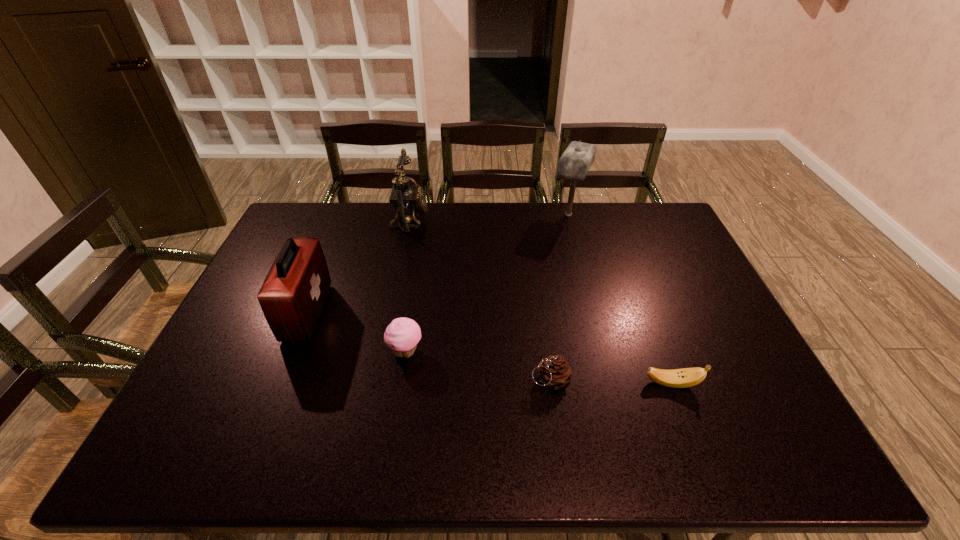
Where is `the second object from right to left`? the second object from right to left is located at coordinates (574, 164).

Where is `the tallest object`? The width and height of the screenshot is (960, 540). the tallest object is located at coordinates (574, 164).

This screenshot has width=960, height=540. What are the coordinates of `telephone` in the screenshot? It's located at tap(405, 198).

This screenshot has width=960, height=540. Identify the location of the leftmost object. (293, 294).

The image size is (960, 540). Identify the location of cupcake. (402, 335).

Identify the location of the fourth object from left to right. (555, 373).

Identify the location of the rightmost object. The image size is (960, 540). (678, 378).

This screenshot has height=540, width=960. Identify the location of free spot located 0.300m on the left of the tallest object. (468, 214).

Image resolution: width=960 pixels, height=540 pixels. Identify the location of vacant space situated 0.200m on the rotary dial of the telephone. (483, 219).

Locate an element on the screen. This screenshot has width=960, height=540. free location located on the side of the leftmost object with the cross symbol is located at coordinates (352, 313).